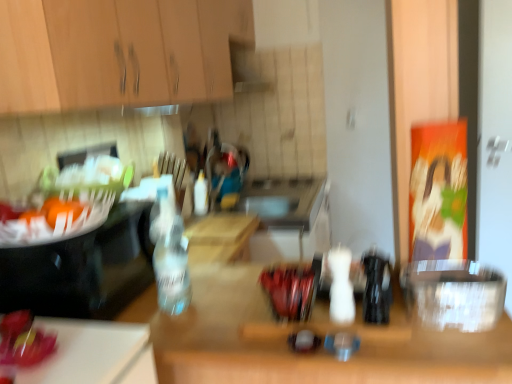
Question: Is point (379, 294) closer or farther from the camera than point (198, 185)?

Choices:
 (A) farther
 (B) closer

Answer: (B)

Question: From the image's perspective, is black plastic bottle at center, the 3th bottle when ordered from left to right, above or below white plastic bottle at center, the 3th bottle from the front?

Choices:
 (A) below
 (B) above

Answer: (A)

Question: Which is nearer to the wooden table at center?

Choices:
 (A) transparent plastic container at right, which is the first appliance from right to left
 (B) wooden cabinet at upper left
 (C) white plastic bottle at center, arranged as the third bottle when viewed from the right
 (D) shiny red apple at lower left
 (E) black plastic bottle at center, the 1th bottle when ordered from front to back

Answer: (A)

Question: Which object is positioned farthest from the clear glass bottle at left, which is the second appliance in right-to-left order?

Choices:
 (A) black plastic bottle at center, which appears as the third bottle when viewed from the back
 (B) transparent plastic container at right, the second appliance positioned from the left
 (C) wooden cabinet at upper left
 (D) shiny red apple at lower left
 (E) white matte bottle at center, arranged as the 2th bottle when viewed from the left

Answer: (B)